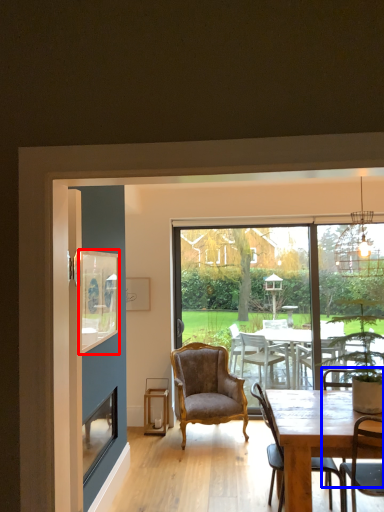
Question: Which object appears closest to the camera in this image, window screen (highlighted by a red box) or armchair (highlighted by a blue box)?

Choices:
 (A) window screen
 (B) armchair

Answer: (B)